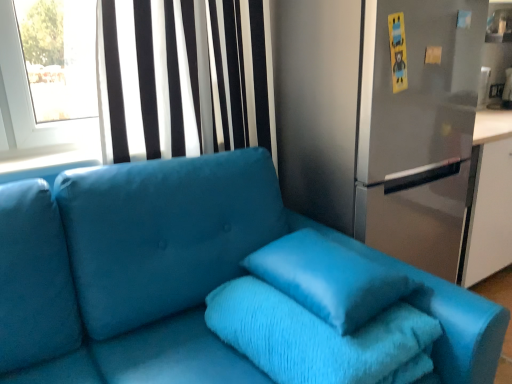
Question: From a real-world perspective, is satin blue couch at center beneath satin blue pillow at center?

Choices:
 (A) yes
 (B) no

Answer: (A)

Question: From the image's perspective, would you say satin blue couch at center is shown under satin blue pillow at center?

Choices:
 (A) yes
 (B) no

Answer: (A)

Question: Is there a large distance between satin blue couch at center and satin blue pillow at center?

Choices:
 (A) no
 (B) yes

Answer: (A)

Question: Is satin blue couch at center wider than satin blue pillow at center?

Choices:
 (A) no
 (B) yes

Answer: (B)

Question: Does satin blue couch at center come in front of satin blue pillow at center?

Choices:
 (A) no
 (B) yes

Answer: (B)

Question: Is satin blue couch at center facing towards satin blue pillow at center?

Choices:
 (A) no
 (B) yes

Answer: (B)

Question: From a real-world perspective, does turquoise plush bath towel at center stand above satin silver fridge at center?

Choices:
 (A) no
 (B) yes

Answer: (A)

Question: Is turquoise plush bath towel at center beside satin silver fridge at center?

Choices:
 (A) yes
 (B) no

Answer: (B)

Question: Does turquoise plush bath towel at center appear on the left side of satin silver fridge at center?

Choices:
 (A) no
 (B) yes

Answer: (B)

Question: From a real-world perspective, is turquoise plush bath towel at center located beneath satin silver fridge at center?

Choices:
 (A) yes
 (B) no

Answer: (A)

Question: Does turquoise plush bath towel at center turn towards satin silver fridge at center?

Choices:
 (A) no
 (B) yes

Answer: (A)

Question: From the image's perspective, is turquoise plush bath towel at center below satin silver fridge at center?

Choices:
 (A) yes
 (B) no

Answer: (A)

Question: From a real-world perspective, is turquoise plush bath towel at center physically above satin black curtain at upper left?

Choices:
 (A) no
 (B) yes

Answer: (A)